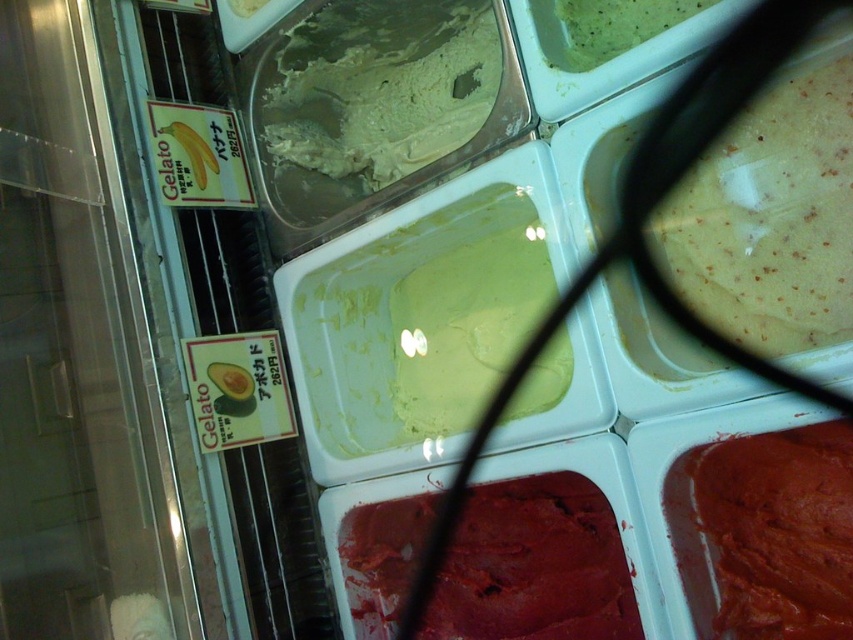
Question: Can you confirm if green matte gelato at center is positioned to the right of smooth red gelato at bottom right?

Choices:
 (A) yes
 (B) no

Answer: (B)

Question: Where is green matte ice cream at center located in relation to green creamy ice cream at upper right in the image?

Choices:
 (A) left
 (B) right

Answer: (A)

Question: Among these objects, which one is nearest to the camera?

Choices:
 (A) yellow speckled ice cream at upper right
 (B) green matte gelato at center
 (C) smooth chocolate ice cream at bottom right
 (D) green creamy ice cream at upper right

Answer: (C)

Question: Which is farther from the yellow speckled ice cream at upper right?

Choices:
 (A) smooth red gelato at bottom right
 (B) smooth chocolate ice cream at bottom right
 (C) green matte gelato at center

Answer: (A)

Question: From the image, what is the correct spatial relationship of smooth red gelato at bottom right in relation to green matte ice cream at center?

Choices:
 (A) left
 (B) right

Answer: (B)

Question: Based on their relative distances, which object is farther from the smooth chocolate ice cream at bottom right?

Choices:
 (A) smooth red gelato at bottom right
 (B) green creamy ice cream at upper right

Answer: (B)